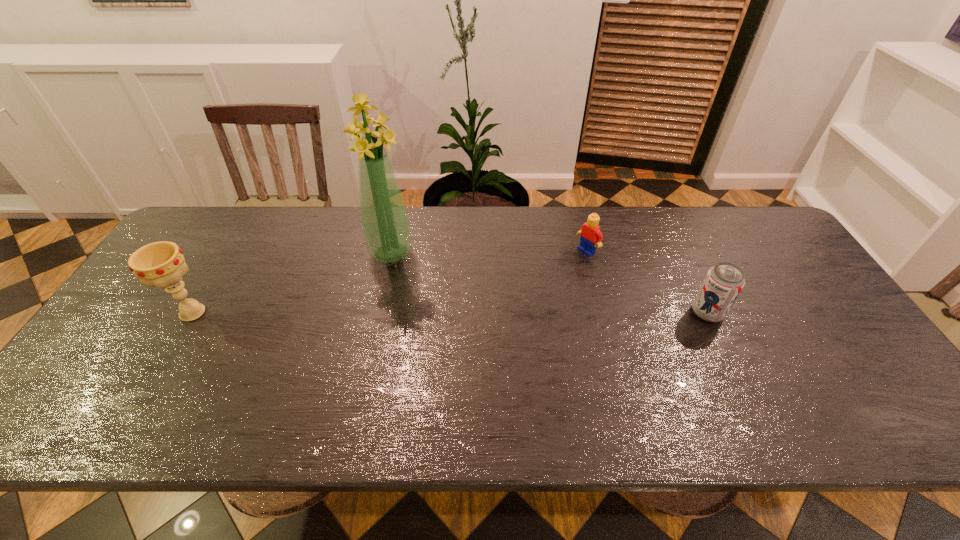
Identify the location of vacant space at the right edge of the desktop. This screenshot has width=960, height=540. (811, 358).

Find the location of a particular element. free location at the far left corner is located at coordinates (183, 232).

Identify the location of free spot at the near left corner of the desktop. (125, 393).

At what (x,y) coordinates should I click in order to perform the action: click on free space at the far right corner of the desktop. Please return your answer as a coordinate pair (x, y). The height and width of the screenshot is (540, 960). Looking at the image, I should click on pyautogui.click(x=753, y=249).

In the image, there is a desktop. Find the location of `vacant area at the near right corner`. vacant area at the near right corner is located at coordinates (839, 370).

Image resolution: width=960 pixels, height=540 pixels. Identify the location of vacant space that is in between the second object from right to left and the beer can. (647, 282).

This screenshot has width=960, height=540. Find the location of `free space between the Lego and the tallest object`. free space between the Lego and the tallest object is located at coordinates (489, 252).

The image size is (960, 540). Identify the location of free space between the tallest object and the chalice. (292, 283).

This screenshot has height=540, width=960. In order to click on empty space that is in between the Lego and the beer can in this screenshot , I will do `click(647, 282)`.

Find the location of `free space between the Lego and the third shortest object`. free space between the Lego and the third shortest object is located at coordinates [x=390, y=282].